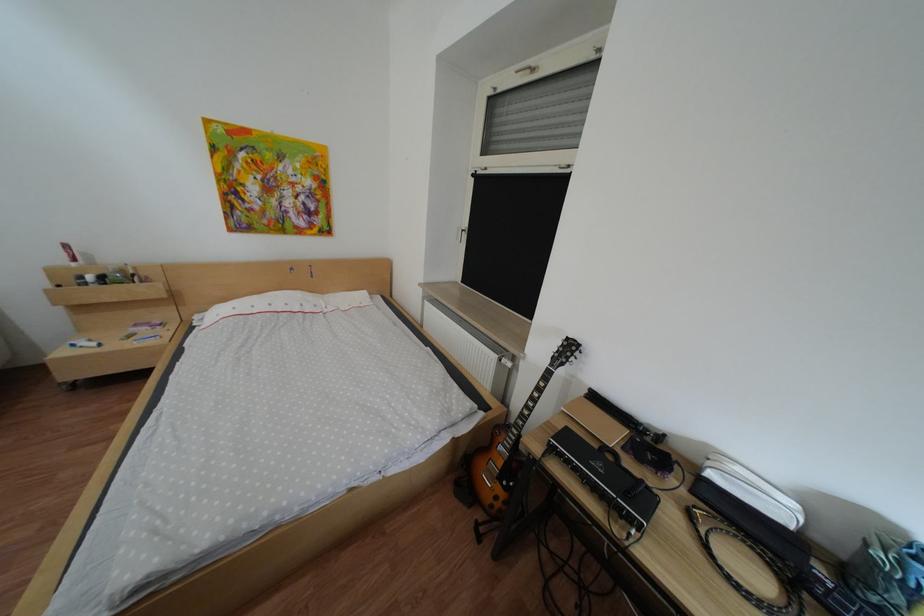
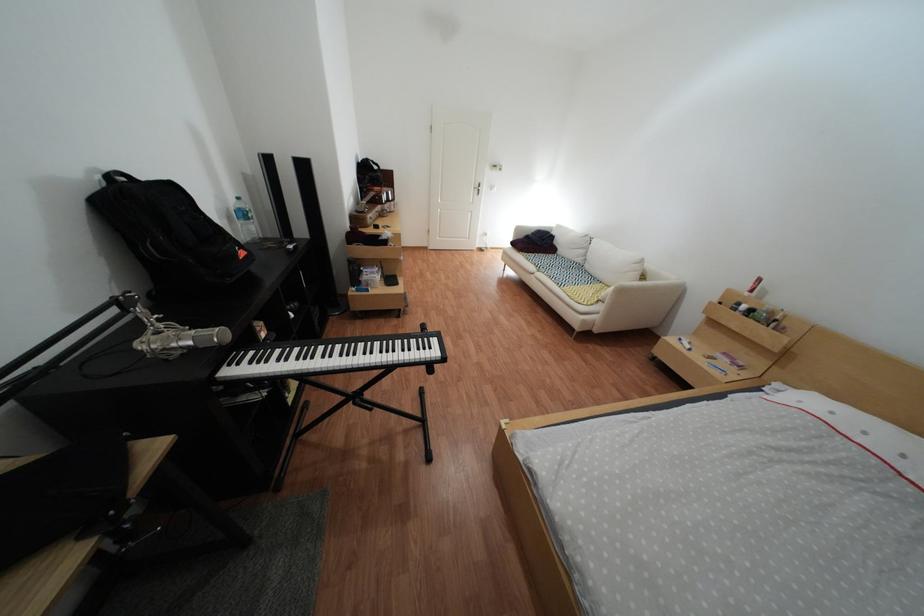
How did the camera likely rotate?

The camera's rotation is toward left-down.